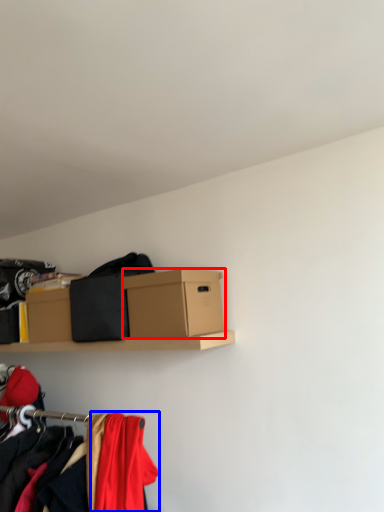
Question: Which object appears closest to the camera in this image, box (highlighted by a red box) or clothing (highlighted by a blue box)?

Choices:
 (A) box
 (B) clothing

Answer: (B)